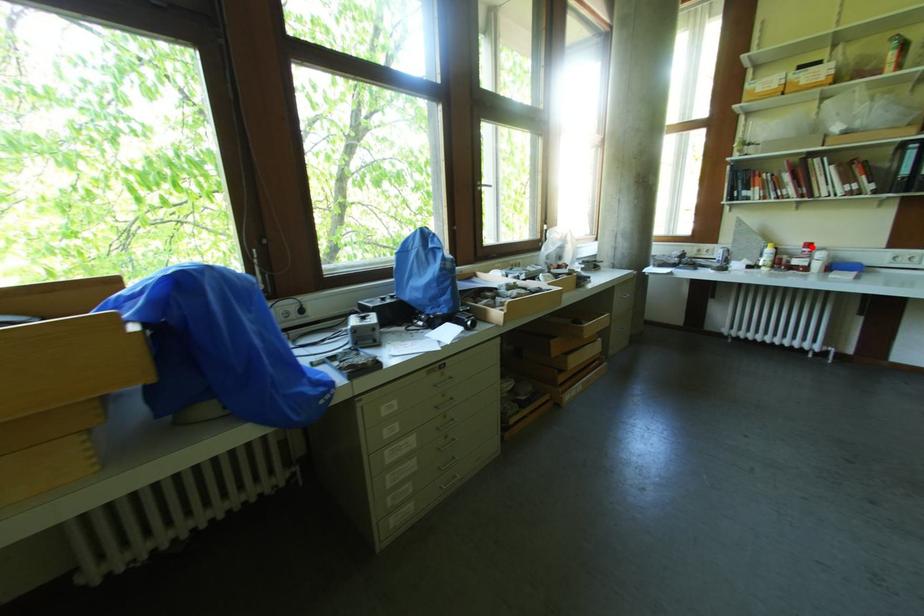
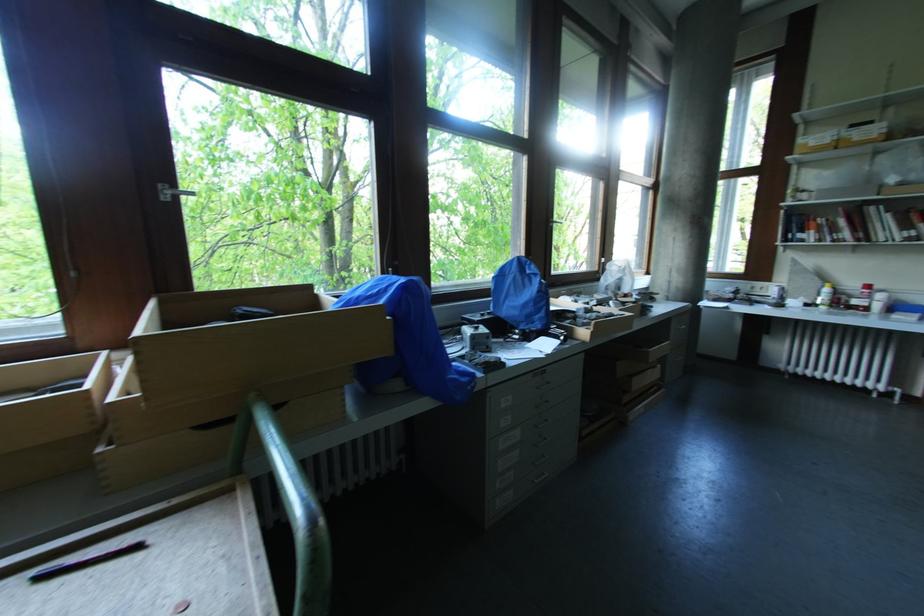
Where in the second image is the point corresponding to the highlighted location from the first image?

(871, 288)